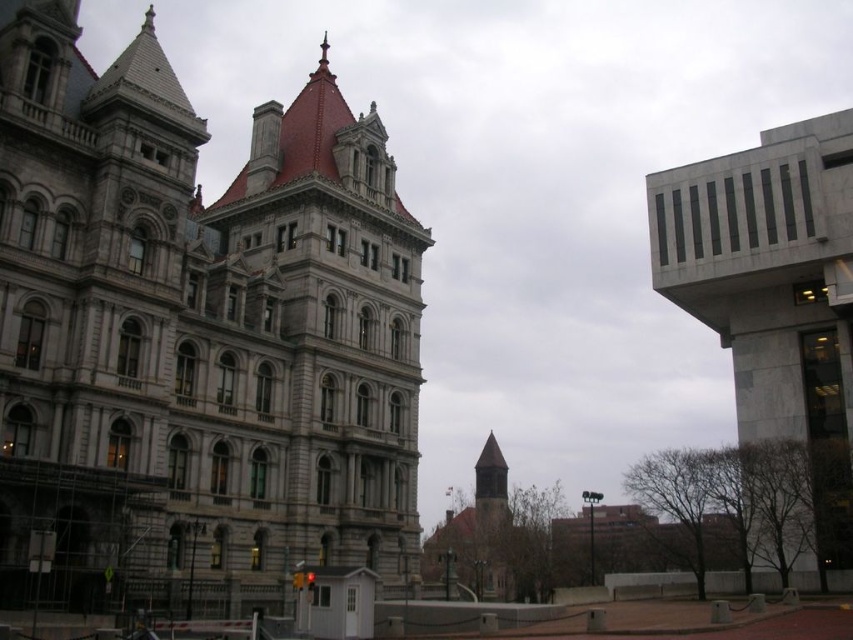
Can you confirm if gray stone tower at center is wider than gray marble tower at right?

No, gray stone tower at center is not wider than gray marble tower at right.

Is point (248, 308) behind point (792, 161)?

No, it is not.

Locate an element on the screen. Image resolution: width=853 pixels, height=640 pixels. gray stone tower at center is located at coordinates (302, 353).